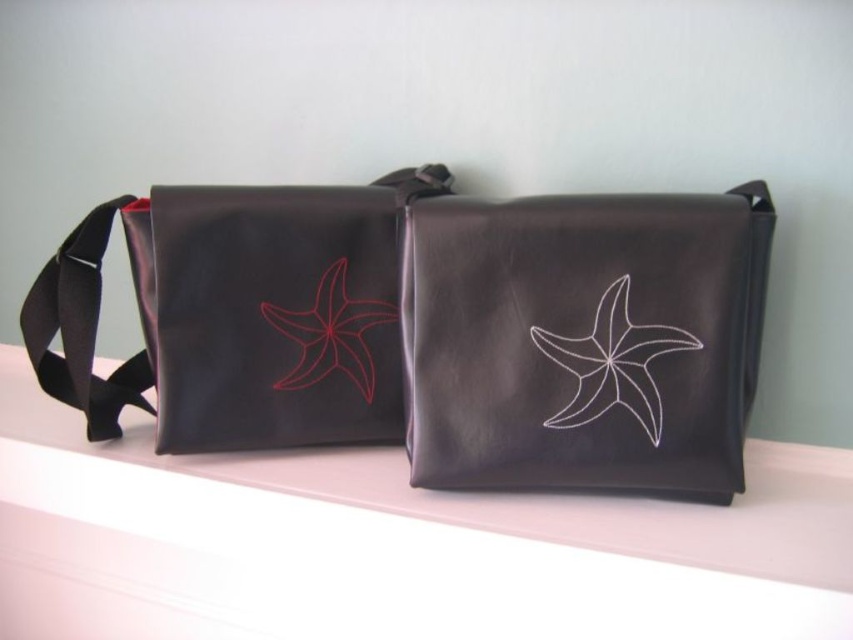
Question: Is white glossy window sill at center positioned in front of black fabric strap at left?

Choices:
 (A) yes
 (B) no

Answer: (A)

Question: Among these objects, which one is nearest to the camera?

Choices:
 (A) matte black shoulder bag at left
 (B) matte black pouch at center
 (C) white glossy window sill at center
 (D) black fabric strap at left

Answer: (C)

Question: Can you confirm if matte black bag at center is bigger than white glossy window sill at center?

Choices:
 (A) yes
 (B) no

Answer: (B)

Question: Which of the following is the closest to the observer?

Choices:
 (A) white matte star at center
 (B) black fabric strap at left

Answer: (A)

Question: Does matte black bag at center have a larger size compared to matte black shoulder bag at left?

Choices:
 (A) no
 (B) yes

Answer: (B)

Question: Which point is closer to the camera?

Choices:
 (A) matte black bag at center
 (B) white matte star at center
 (C) white glossy window sill at center
 (D) matte black pouch at center

Answer: (C)